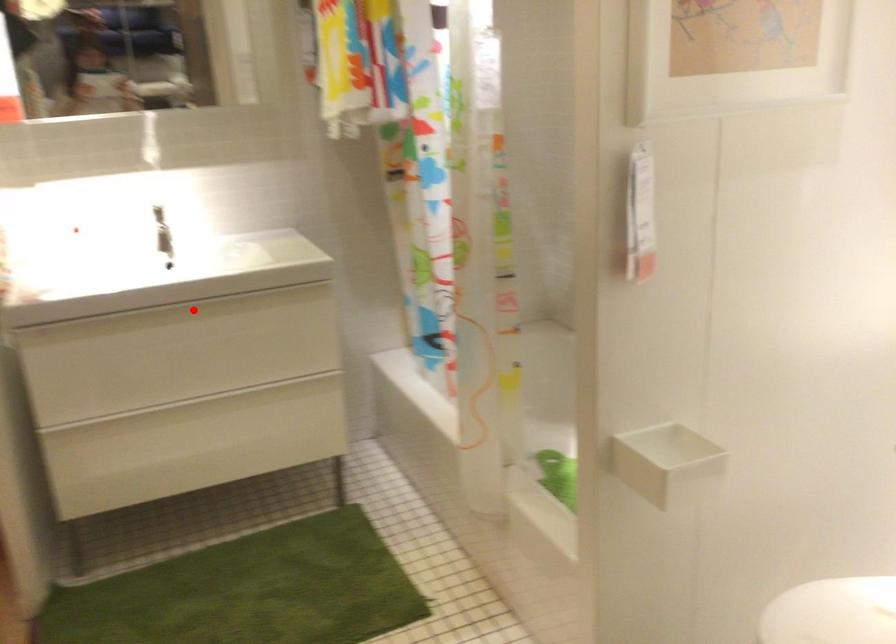
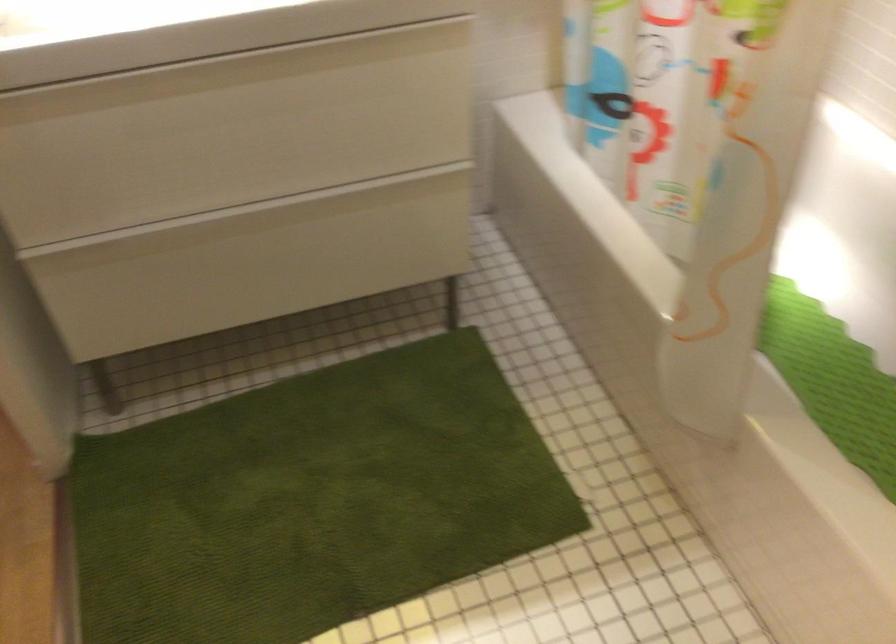
Question: I am providing you with two images of the same scene from different viewpoints. A red point is marked on the first image. Can you still see the location of the red point in image 2?

Choices:
 (A) Yes
 (B) No

Answer: (A)